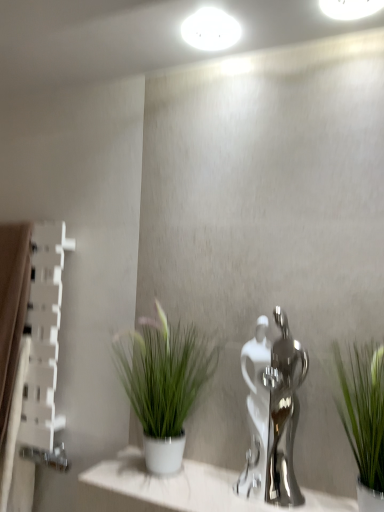
What do you see at coordinates (350, 8) in the screenshot? I see `white glossy light fixture at upper center, the second lighting when ordered from back to front` at bounding box center [350, 8].

How much space does white glossy light fixture at upper center, acting as the first lighting starting from the right, occupy vertically?

white glossy light fixture at upper center, acting as the first lighting starting from the right, is 0.68 inches tall.

What do you see at coordinates (210, 30) in the screenshot?
I see `white glossy light fixture at upper center, acting as the 1th lighting starting from the left` at bounding box center [210, 30].

Locate an element on the screen. The image size is (384, 512). green leafy plant at right, which is the second houseplant from left to right is located at coordinates (364, 419).

What do you see at coordinates (12, 340) in the screenshot?
I see `brown fabric curtain at left` at bounding box center [12, 340].

Locate an element on the screen. The height and width of the screenshot is (512, 384). polished chrome faucet at center is located at coordinates (272, 414).

From the image's perspective, does green matte plant at center, the second houseplant positioned from the front, appear lower than brown fabric curtain at left?

No.

From the picture: Is brown fabric curtain at left at the back of green matte plant at center, which is the 2th houseplant from right to left?

No, green matte plant at center, which is the 2th houseplant from right to left, is not facing the opposite direction of brown fabric curtain at left.

From a real-world perspective, is green matte plant at center, which is the 2th houseplant from right to left, positioned over brown fabric curtain at left based on gravity?

Indeed, from a real-world perspective, green matte plant at center, which is the 2th houseplant from right to left, stands above brown fabric curtain at left.

You are a GUI agent. You are given a task and a screenshot of the screen. Output one action in this format:
    pyautogui.click(x=<x>, y=<y>)
    Task: Click on the 1st houseplant in front of the brown fabric curtain at left, starting your count from the anchor
    
    Given the screenshot: What is the action you would take?
    pyautogui.click(x=163, y=384)

Is polished chrome faucet at center to the left of white glossy ledge at center from the viewer's perspective?

No.

Is white glossy ledge at center a part of polished chrome faucet at center?

That's incorrect, white glossy ledge at center is not inside polished chrome faucet at center.

Consider the image. Is polished chrome faucet at center turned away from white glossy ledge at center?

polished chrome faucet at center is not turned away from white glossy ledge at center.

Measure the distance between polished chrome faucet at center and white glossy light fixture at upper center, which is the 2th lighting from left to right.

polished chrome faucet at center is 35.92 inches away from white glossy light fixture at upper center, which is the 2th lighting from left to right.

Looking at this image, from a real-world perspective, is polished chrome faucet at center positioned under white glossy light fixture at upper center, acting as the first lighting starting from the right, based on gravity?

Indeed, from a real-world perspective, polished chrome faucet at center is positioned beneath white glossy light fixture at upper center, acting as the first lighting starting from the right.

Is polished chrome faucet at center completely or partially outside of white glossy light fixture at upper center, the second lighting when ordered from back to front?

Yes, polished chrome faucet at center is outside of white glossy light fixture at upper center, the second lighting when ordered from back to front.

Which object is more forward, polished chrome faucet at center or white glossy light fixture at upper center, acting as the first lighting starting from the front?

white glossy light fixture at upper center, acting as the first lighting starting from the front, is closer to the camera.

Could you measure the distance between white glossy light fixture at upper center, acting as the first lighting starting from the right, and green matte plant at center, which is counted as the first houseplant, starting from the left?

white glossy light fixture at upper center, acting as the first lighting starting from the right, and green matte plant at center, which is counted as the first houseplant, starting from the left, are 38.58 inches apart.

Can you tell me how much white glossy light fixture at upper center, acting as the first lighting starting from the front, and green matte plant at center, which is the 2th houseplant from right to left, differ in facing direction?

There is a 0.877-degree angle between the facing directions of white glossy light fixture at upper center, acting as the first lighting starting from the front, and green matte plant at center, which is the 2th houseplant from right to left.

From a real-world perspective, is white glossy light fixture at upper center, acting as the first lighting starting from the front, on green matte plant at center, which is counted as the first houseplant, starting from the left?

Indeed, from a real-world perspective, white glossy light fixture at upper center, acting as the first lighting starting from the front, stands above green matte plant at center, which is counted as the first houseplant, starting from the left.

Does white glossy light fixture at upper center, the second lighting when ordered from back to front, have a greater height compared to green matte plant at center, the second houseplant positioned from the front?

In fact, white glossy light fixture at upper center, the second lighting when ordered from back to front, may be shorter than green matte plant at center, the second houseplant positioned from the front.

Is polished chrome faucet at center spatially inside brown fabric curtain at left, or outside of it?

polished chrome faucet at center is located beyond the bounds of brown fabric curtain at left.

Considering the sizes of polished chrome faucet at center and brown fabric curtain at left in the image, is polished chrome faucet at center taller or shorter than brown fabric curtain at left?

Clearly, polished chrome faucet at center is shorter compared to brown fabric curtain at left.

Would you consider polished chrome faucet at center to be distant from brown fabric curtain at left?

Actually, polished chrome faucet at center and brown fabric curtain at left are a little close together.

Considering the points (263, 467) and (0, 292), which point is in front, point (263, 467) or point (0, 292)?

The point (263, 467) is in front.

Considering the relative sizes of green leafy plant at right, which is the second houseplant from left to right, and polished chrome faucet at center in the image provided, is green leafy plant at right, which is the second houseplant from left to right, shorter than polished chrome faucet at center?

Indeed, green leafy plant at right, which is the second houseplant from left to right, has a lesser height compared to polished chrome faucet at center.

Would you say polished chrome faucet at center is part of green leafy plant at right, the first houseplant positioned from the front,'s contents?

Actually, polished chrome faucet at center is outside green leafy plant at right, the first houseplant positioned from the front.

Is green leafy plant at right, acting as the second houseplant starting from the back, positioned in front of polished chrome faucet at center?

Yes, green leafy plant at right, acting as the second houseplant starting from the back, is closer to the viewer.

From a real-world perspective, who is located higher, green leafy plant at right, the first houseplant positioned from the right, or polished chrome faucet at center?

From a 3D spatial view, polished chrome faucet at center is above.

Is white glossy light fixture at upper center, arranged as the first lighting when viewed from the back, at the back of brown fabric curtain at left?

brown fabric curtain at left does not have its back to white glossy light fixture at upper center, arranged as the first lighting when viewed from the back.

The image size is (384, 512). What are the coordinates of `curtain located behind the white glossy light fixture at upper center, arranged as the first lighting when viewed from the back` in the screenshot? It's located at (12, 340).

From the picture: Could you measure the distance between brown fabric curtain at left and white glossy light fixture at upper center, placed as the 2th lighting when sorted from front to back?

A distance of 36.29 inches exists between brown fabric curtain at left and white glossy light fixture at upper center, placed as the 2th lighting when sorted from front to back.

Can you confirm if brown fabric curtain at left is thinner than white glossy light fixture at upper center, placed as the 2th lighting when sorted from front to back?

In fact, brown fabric curtain at left might be wider than white glossy light fixture at upper center, placed as the 2th lighting when sorted from front to back.

Which houseplant is the 1st one when counting from the right side of the brown fabric curtain at left? Please provide its 2D coordinates.

[(163, 384)]

Where is `ledge in front of the polished chrome faucet at center`? This screenshot has height=512, width=384. ledge in front of the polished chrome faucet at center is located at coordinates (179, 490).

Considering their positions, is white glossy light fixture at upper center, acting as the 1th lighting starting from the left, positioned further to polished chrome faucet at center than white glossy light fixture at upper center, the second lighting when ordered from back to front?

white glossy light fixture at upper center, the second lighting when ordered from back to front, is positioned further to the anchor polished chrome faucet at center.

From the image, which object appears to be nearer to white glossy ledge at center, white glossy light fixture at upper center, which is the 2th lighting in right-to-left order, or green leafy plant at right, which is the second houseplant from left to right?

The object closer to white glossy ledge at center is green leafy plant at right, which is the second houseplant from left to right.

Considering their positions, is white glossy ledge at center positioned closer to white glossy light fixture at upper center, placed as the 2th lighting when sorted from front to back, than polished chrome faucet at center?

Among the two, polished chrome faucet at center is located nearer to white glossy light fixture at upper center, placed as the 2th lighting when sorted from front to back.

From the image, which object appears to be farther from green leafy plant at right, the first houseplant positioned from the front, white glossy light fixture at upper center, which is the 2th lighting in right-to-left order, or polished chrome faucet at center?

white glossy light fixture at upper center, which is the 2th lighting in right-to-left order, is positioned further to the anchor green leafy plant at right, the first houseplant positioned from the front.

Estimate the real-world distances between objects in this image. Which object is further from white glossy light fixture at upper center, the second lighting when ordered from back to front, brown fabric curtain at left or polished chrome faucet at center?

brown fabric curtain at left.

When comparing their distances from brown fabric curtain at left, does polished chrome faucet at center or white glossy light fixture at upper center, the second lighting when ordered from back to front, seem closer?

Among the two, polished chrome faucet at center is located nearer to brown fabric curtain at left.

Looking at this image, considering their positions, is green matte plant at center, which appears as the first houseplant when viewed from the back, positioned closer to white glossy ledge at center than green leafy plant at right, acting as the second houseplant starting from the back?

Based on the image, green matte plant at center, which appears as the first houseplant when viewed from the back, appears to be nearer to white glossy ledge at center.

When comparing their distances from white glossy ledge at center, does white glossy light fixture at upper center, which is the 2th lighting from left to right, or polished chrome faucet at center seem closer?

polished chrome faucet at center is positioned closer to the anchor white glossy ledge at center.

Find the location of `houseplant situated between brown fabric curtain at left and white glossy ledge at center from left to right`. houseplant situated between brown fabric curtain at left and white glossy ledge at center from left to right is located at coordinates (163, 384).

At what (x,y) coordinates should I click in order to perform the action: click on curtain between white glossy light fixture at upper center, the second lighting when ordered from back to front, and white glossy ledge at center from top to bottom. Please return your answer as a coordinate pair (x, y). Looking at the image, I should click on (12, 340).

At what (x,y) coordinates should I click in order to perform the action: click on houseplant between white glossy light fixture at upper center, acting as the first lighting starting from the front, and polished chrome faucet at center from top to bottom. Please return your answer as a coordinate pair (x, y). Image resolution: width=384 pixels, height=512 pixels. Looking at the image, I should click on (163, 384).

This screenshot has height=512, width=384. In order to click on tap located between white glossy ledge at center and green leafy plant at right, the first houseplant positioned from the right, in the left-right direction in this screenshot , I will do `click(272, 414)`.